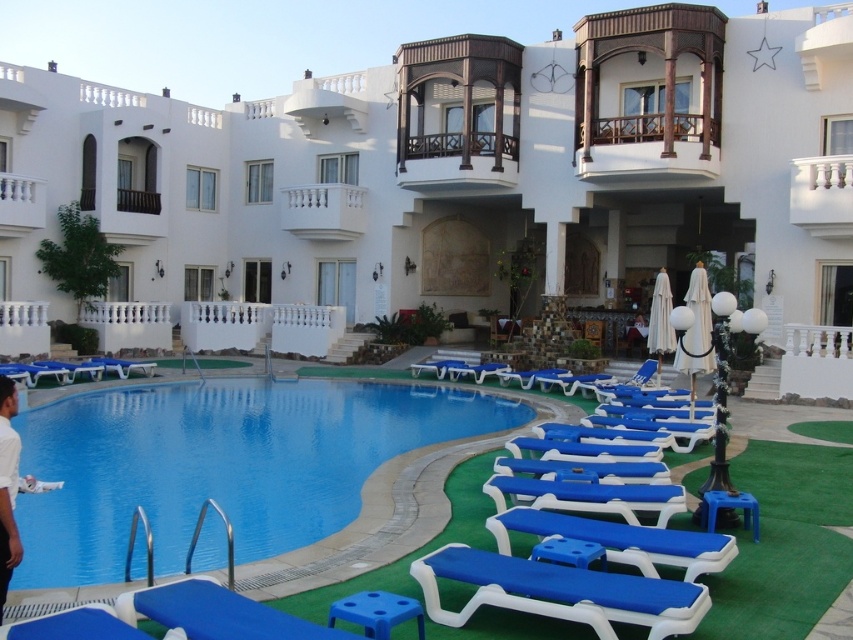
You are a guest at the resort and want to place a large sun umbrella between the blue plastic lounge chairs at lower center and the blue plastic pool at center. Which object should you place the umbrella closer to if you want it to be more visible from the pool area?

The blue plastic lounge chairs at lower center are larger in size compared to the blue plastic pool at center. To make the sun umbrella more visible from the pool area, place it closer to the blue plastic lounge chairs at lower center since their larger size can provide a better reference point for visibility.

You are a guest at the resort and want to place your white cotton shirt at lower left on a nearby chair. Can you put it on the blue plastic chair at lower center?

The blue plastic chair at lower center is located below the white cotton shirt at lower left, so the shirt is already placed on the chair or positioned above it. However, without knowing the exact distance or orientation, it might be possible to place the shirt on the chair if they are within reach.